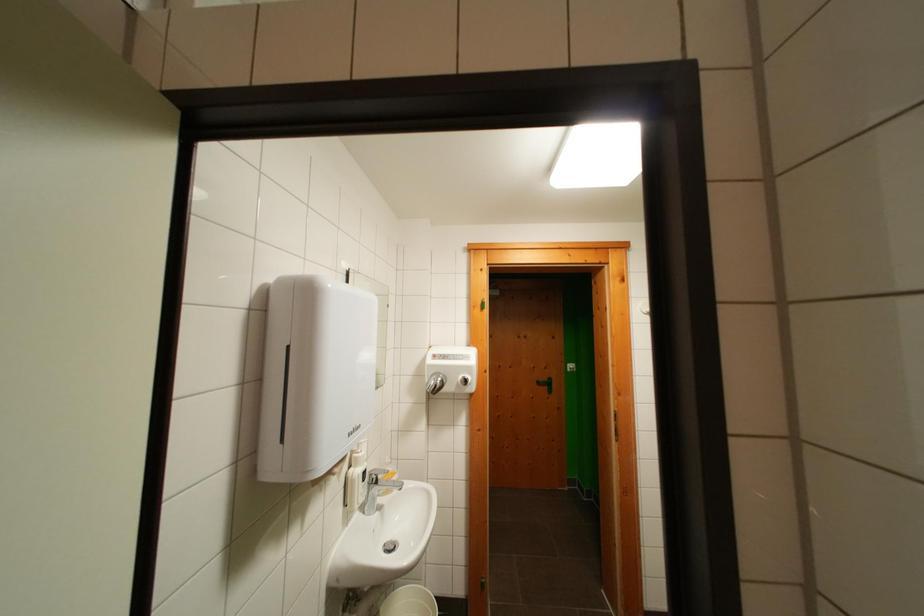
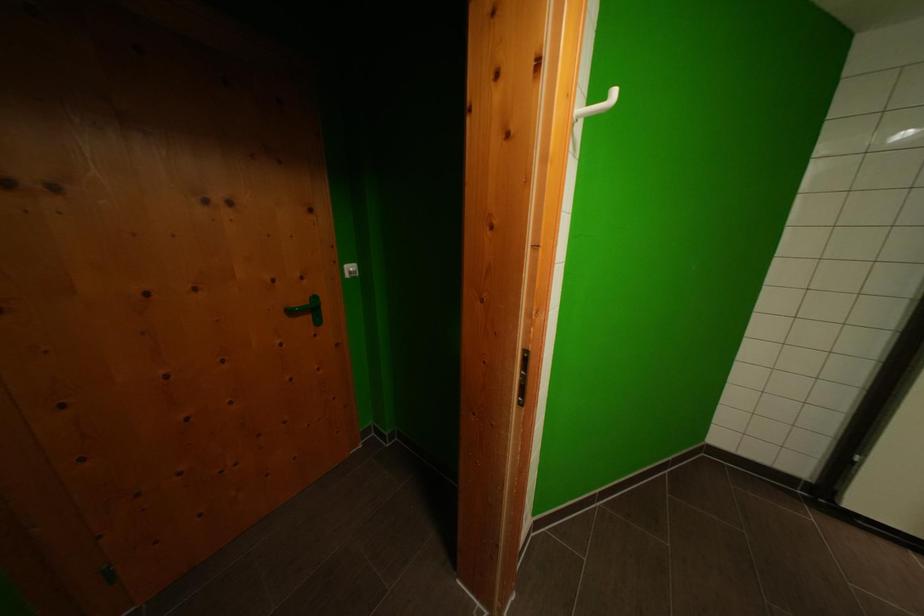
Locate, in the second image, the point that corresponds to (578,369) in the first image.

(358, 272)